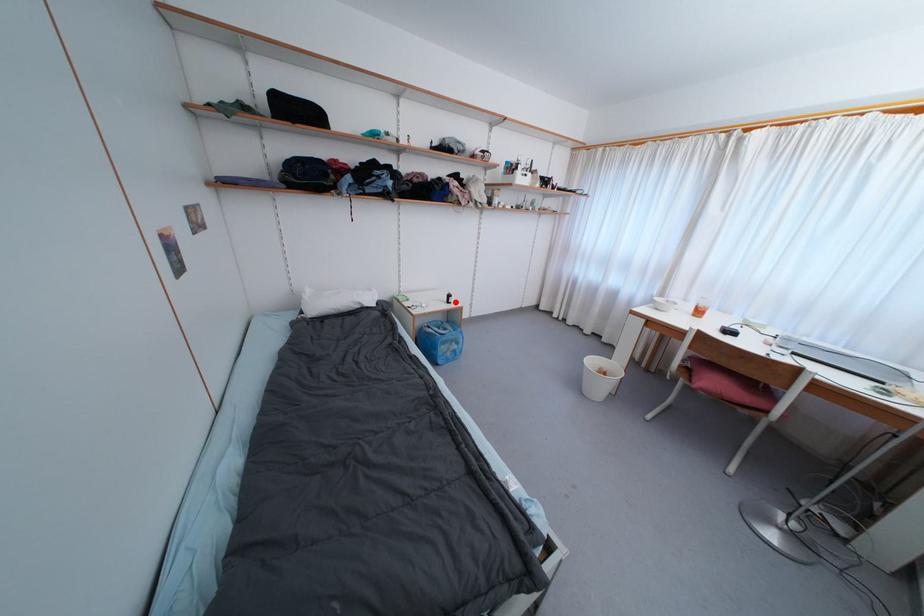
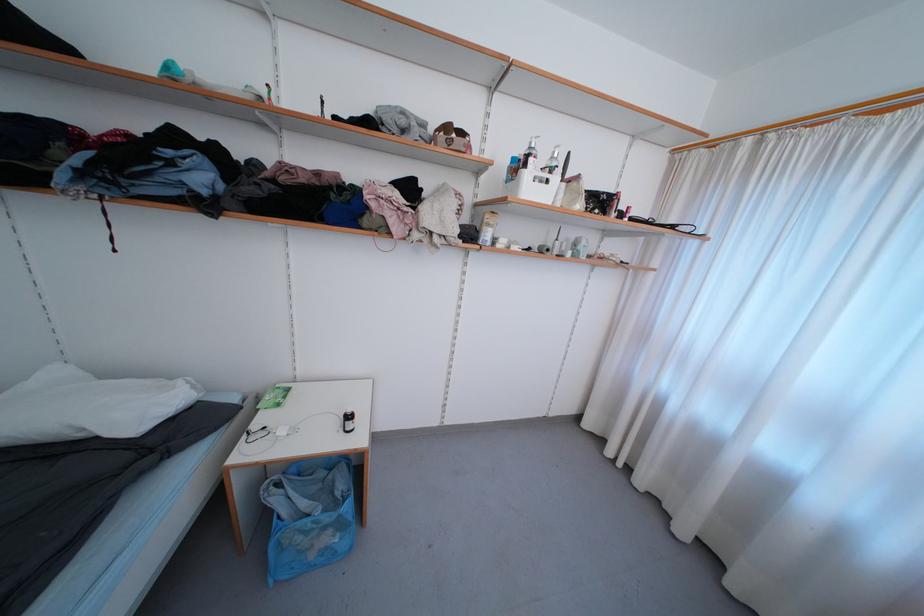
In the second image, find the point that corresponds to the highlighted location in the first image.

(354, 429)